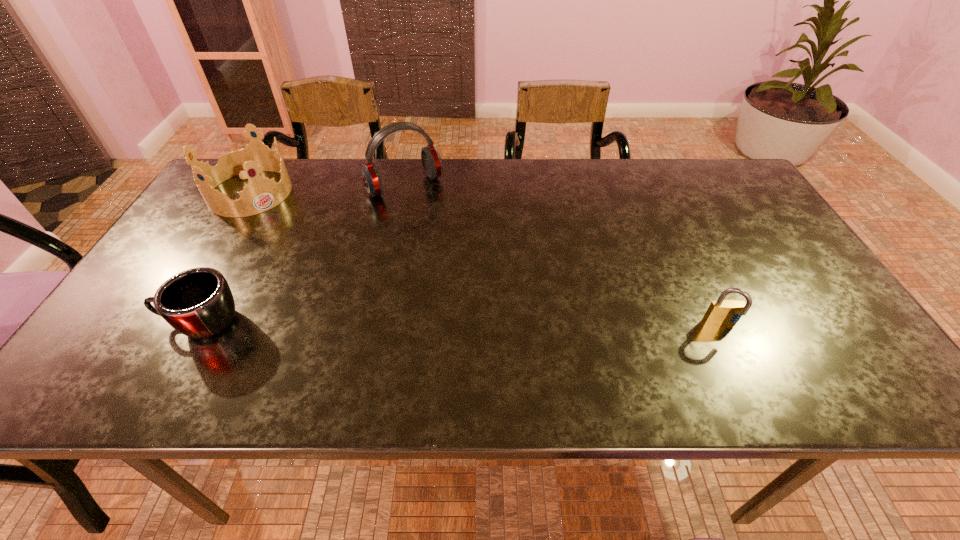
What are the coordinates of `free space on the desktop that is between the mug and the rightmost object and is positioned on the ear cups of the tallest object` in the screenshot? It's located at (510, 325).

Identify the location of vacant space on the desktop that is between the mug and the rightmost object and is positioned on the front-facing side of the tiara. (388, 323).